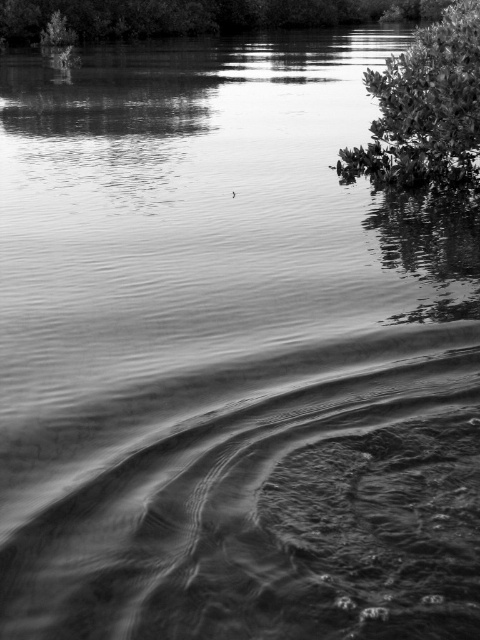
Question: Is green leafy tree at upper right thinner than smooth green foliage at upper center?

Choices:
 (A) yes
 (B) no

Answer: (A)

Question: Which point is closer to the camera taking this photo?

Choices:
 (A) (373, 128)
 (B) (40, 28)

Answer: (A)

Question: Which point is closer to the camera?

Choices:
 (A) green leafy tree at upper right
 (B) smooth green foliage at upper center

Answer: (A)

Question: Does green leafy tree at upper right appear under smooth green foliage at upper center?

Choices:
 (A) yes
 (B) no

Answer: (A)

Question: Does green leafy tree at upper right appear on the right side of smooth green foliage at upper center?

Choices:
 (A) yes
 (B) no

Answer: (A)